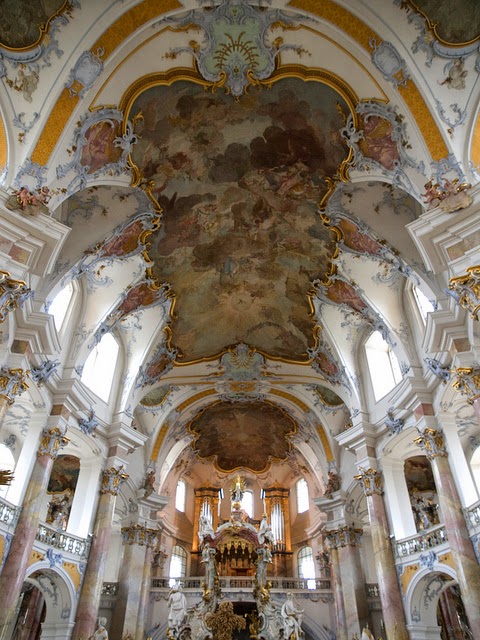
You are a GUI agent. You are given a task and a screenshot of the screen. Output one action in this format:
    pyautogui.click(x=<x>, y=<y>)
    Task: Click on the curved white boards
    The image size is (480, 640).
    Given the screenshot: What is the action you would take?
    pyautogui.click(x=105, y=326), pyautogui.click(x=65, y=272), pyautogui.click(x=135, y=362), pyautogui.click(x=338, y=360), pyautogui.click(x=410, y=246)